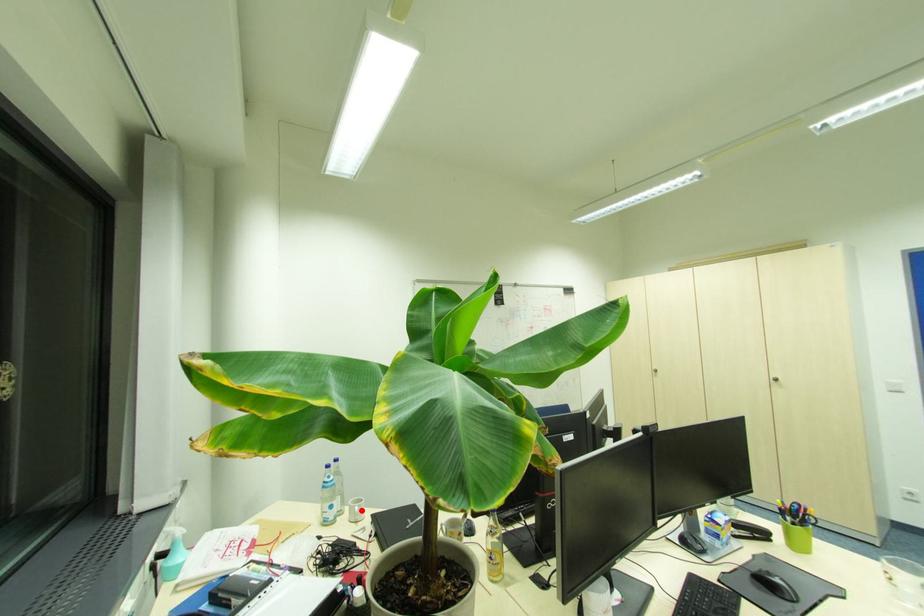
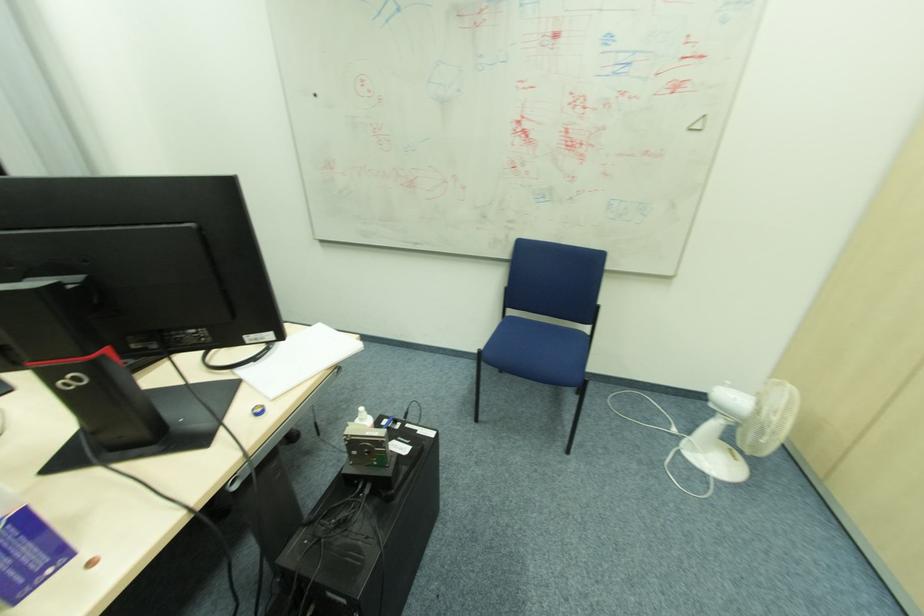
Question: I am providing you with two images of the same scene from different viewpoints. A red point is marked on the first image. At the location where the point appears in image 1, is it still visible in image 2?

Choices:
 (A) Yes
 (B) No

Answer: (B)